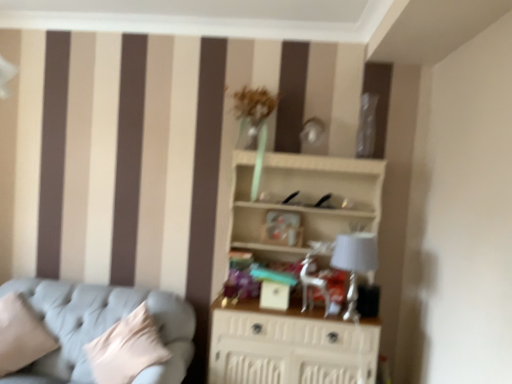
Image resolution: width=512 pixels, height=384 pixels. Describe the element at coordinates (303, 199) in the screenshot. I see `white wood shelf at center` at that location.

The height and width of the screenshot is (384, 512). What do you see at coordinates (101, 327) in the screenshot?
I see `light blue fabric couch at lower left` at bounding box center [101, 327].

You are a GUI agent. You are given a task and a screenshot of the screen. Output one action in this format:
    pyautogui.click(x=<x>, y=<y>)
    Task: Click on the beige fabric pillow at lower left
    This screenshot has height=384, width=512.
    Given the screenshot: What is the action you would take?
    pyautogui.click(x=21, y=334)

From a real-world perspective, is light blue fabric couch at lower left positioned under beige fabric pillow at lower left based on gravity?

Incorrect, from a real-world perspective, light blue fabric couch at lower left is higher than beige fabric pillow at lower left.

Are light blue fabric couch at lower left and beige fabric pillow at lower left beside each other?

light blue fabric couch at lower left and beige fabric pillow at lower left are not in contact.

Between light blue fabric couch at lower left and beige fabric pillow at lower left, which one has larger width?

Wider between the two is beige fabric pillow at lower left.

Between light blue fabric couch at lower left and beige fabric pillow at lower left, which one has less height?

Standing shorter between the two is light blue fabric couch at lower left.

Is silver metallic swivel chair at center oriented away from beige fabric pillow at lower left?

No, silver metallic swivel chair at center's orientation is not away from beige fabric pillow at lower left.

Is silver metallic swivel chair at center shorter than beige fabric pillow at lower left?

Correct, silver metallic swivel chair at center is not as tall as beige fabric pillow at lower left.

From a real-world perspective, who is located higher, silver metallic swivel chair at center or beige fabric pillow at lower left?

silver metallic swivel chair at center.

From the image's perspective, which one is positioned lower, silver metallic swivel chair at center or beige fabric pillow at lower left?

beige fabric pillow at lower left.

Is silver metallic swivel chair at center located outside white wood shelf at center?

No, silver metallic swivel chair at center is inside or overlapping with white wood shelf at center.

From the image's perspective, is silver metallic swivel chair at center positioned above or below white wood shelf at center?

From the image's perspective, silver metallic swivel chair at center appears above white wood shelf at center.

Does silver metallic swivel chair at center have a lesser height compared to white wood shelf at center?

Answer: Yes, silver metallic swivel chair at center is shorter than white wood shelf at center.

Can you confirm if beige fabric pillow at lower left is smaller than white wood shelf at center?

Correct, beige fabric pillow at lower left occupies less space than white wood shelf at center.

Considering the points (10, 294) and (304, 220), which point is behind, point (10, 294) or point (304, 220)?

The point (304, 220) is farther from the camera.

Are beige fabric pillow at lower left and white wood shelf at center beside each other?

No, beige fabric pillow at lower left is not touching white wood shelf at center.

Is beige fabric pillow at lower left wider or thinner than white wood shelf at center?

In the image, beige fabric pillow at lower left appears to be wider than white wood shelf at center.

From the image's perspective, does light blue fabric couch at lower left appear lower than white fabric lampshade at right?

Yes, from the image's perspective, light blue fabric couch at lower left is below white fabric lampshade at right.

From a real-world perspective, is light blue fabric couch at lower left located beneath white fabric lampshade at right?

Yes, from a real-world perspective, light blue fabric couch at lower left is beneath white fabric lampshade at right.

Is light blue fabric couch at lower left not within white fabric lampshade at right?

Yes, light blue fabric couch at lower left is not within white fabric lampshade at right.

Is light blue fabric couch at lower left far away from white fabric lampshade at right?

Absolutely, light blue fabric couch at lower left is distant from white fabric lampshade at right.

Considering the sizes of white wood shelf at center and silver metallic swivel chair at center in the image, is white wood shelf at center taller or shorter than silver metallic swivel chair at center?

Considering their sizes, white wood shelf at center has more height than silver metallic swivel chair at center.

Would you say white wood shelf at center is to the left or to the right of silver metallic swivel chair at center in the picture?

white wood shelf at center is positioned on silver metallic swivel chair at center's left side.

From the image's perspective, is white wood shelf at center above or below silver metallic swivel chair at center?

From the image's perspective, white wood shelf at center appears below silver metallic swivel chair at center.

Based on the photo, is the surface of white wood shelf at center in direct contact with silver metallic swivel chair at center?

There is a gap between white wood shelf at center and silver metallic swivel chair at center.

Considering the sizes of objects white fabric lampshade at right and white wood shelf at center in the image provided, who is shorter, white fabric lampshade at right or white wood shelf at center?

With less height is white fabric lampshade at right.

Where is `shelf that is under the white fabric lampshade at right (from a real-world perspective)`? This screenshot has width=512, height=384. shelf that is under the white fabric lampshade at right (from a real-world perspective) is located at coordinates (303, 199).

Is white fabric lampshade at right closer to the viewer compared to white wood shelf at center?

No, white fabric lampshade at right is further to the viewer.

Does point (342, 269) lie behind point (234, 203)?

No, it is not.

You are a GUI agent. You are given a task and a screenshot of the screen. Output one action in this format:
    pyautogui.click(x=<x>, y=<y>)
    Task: Click on the studio couch in front of the beige fabric pillow at lower left
    
    Given the screenshot: What is the action you would take?
    pyautogui.click(x=101, y=327)

Locate an element on the screen. The image size is (512, 384). pillow below the silver metallic swivel chair at center (from the image's perspective) is located at coordinates (21, 334).

From the image, which object appears to be nearer to beige fabric pillow at lower left, silver metallic swivel chair at center or white wood shelf at center?

Among the two, white wood shelf at center is located nearer to beige fabric pillow at lower left.

When comparing their distances from silver metallic swivel chair at center, does white wood shelf at center or beige fabric pillow at lower left seem further?

Based on the image, beige fabric pillow at lower left appears to be further to silver metallic swivel chair at center.

Estimate the real-world distances between objects in this image. Which object is further from beige fabric pillow at lower left, light blue fabric couch at lower left or silver metallic swivel chair at center?

Based on the image, silver metallic swivel chair at center appears to be further to beige fabric pillow at lower left.

Looking at the image, which one is located closer to beige fabric pillow at lower left, white fabric lampshade at right or light blue fabric couch at lower left?

Among the two, light blue fabric couch at lower left is located nearer to beige fabric pillow at lower left.

Looking at the image, which one is located closer to beige fabric pillow at lower left, silver metallic swivel chair at center or white fabric lampshade at right?

Among the two, silver metallic swivel chair at center is located nearer to beige fabric pillow at lower left.

Based on their spatial positions, is white wood shelf at center or silver metallic swivel chair at center further from white fabric lampshade at right?

white wood shelf at center is positioned further to the anchor white fabric lampshade at right.

Looking at the image, which one is located further to light blue fabric couch at lower left, white fabric lampshade at right or silver metallic swivel chair at center?

The object further to light blue fabric couch at lower left is white fabric lampshade at right.

Based on their spatial positions, is white wood shelf at center or light blue fabric couch at lower left closer to beige fabric pillow at lower left?

light blue fabric couch at lower left.

Locate an element on the screen. Image resolution: width=512 pixels, height=384 pixels. studio couch between beige fabric pillow at lower left and silver metallic swivel chair at center is located at coordinates (101, 327).

Image resolution: width=512 pixels, height=384 pixels. What are the coordinates of `shelf situated between light blue fabric couch at lower left and white fabric lampshade at right from left to right` in the screenshot? It's located at (303, 199).

The width and height of the screenshot is (512, 384). In order to click on swivel chair situated between beige fabric pillow at lower left and white fabric lampshade at right from left to right in this screenshot , I will do `click(314, 276)`.

Image resolution: width=512 pixels, height=384 pixels. In order to click on shelf between light blue fabric couch at lower left and silver metallic swivel chair at center in the horizontal direction in this screenshot , I will do `click(303, 199)`.